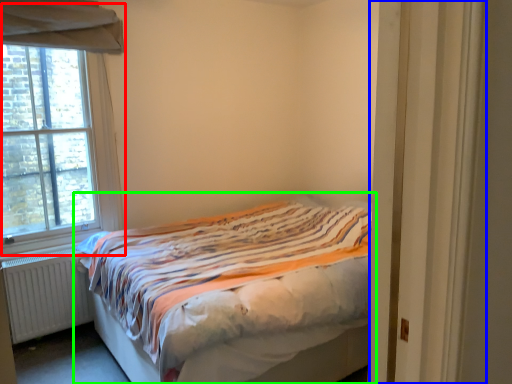
Question: Which object is positioned farthest from window (highlighted by a red box)? Select from door (highlighted by a blue box) and bed (highlighted by a green box).

Choices:
 (A) door
 (B) bed

Answer: (A)